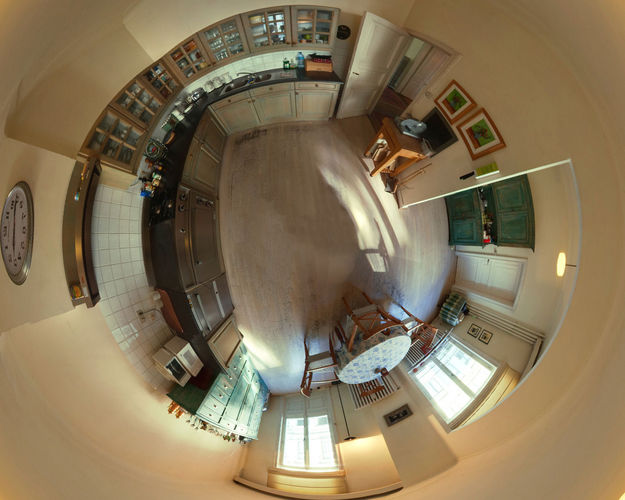
At what (x,y) coordinates should I click in order to perform the action: click on sink. Please return your answer as a coordinate pair (x, y). The width and height of the screenshot is (625, 500). Looking at the image, I should click on (252, 80).